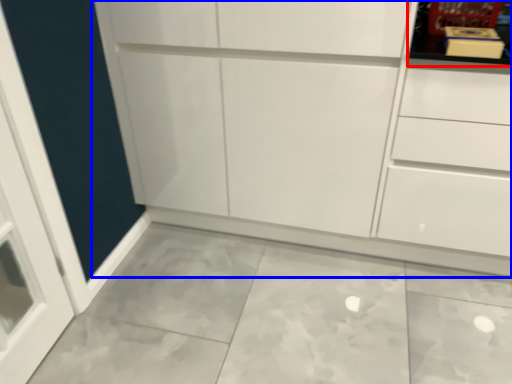
Question: Which object appears farthest to the camera in this image, shelf (highlighted by a red box) or cupboard (highlighted by a blue box)?

Choices:
 (A) shelf
 (B) cupboard

Answer: (A)